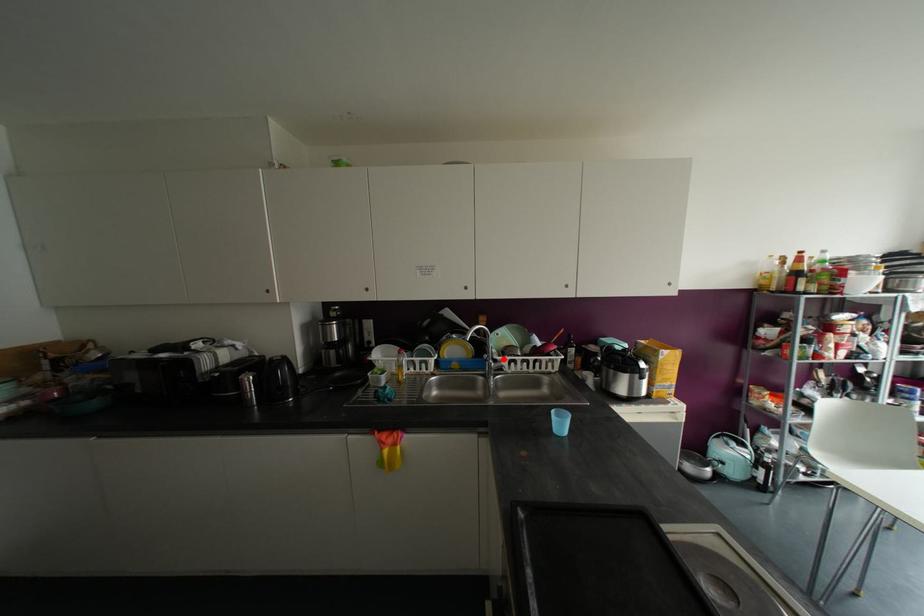
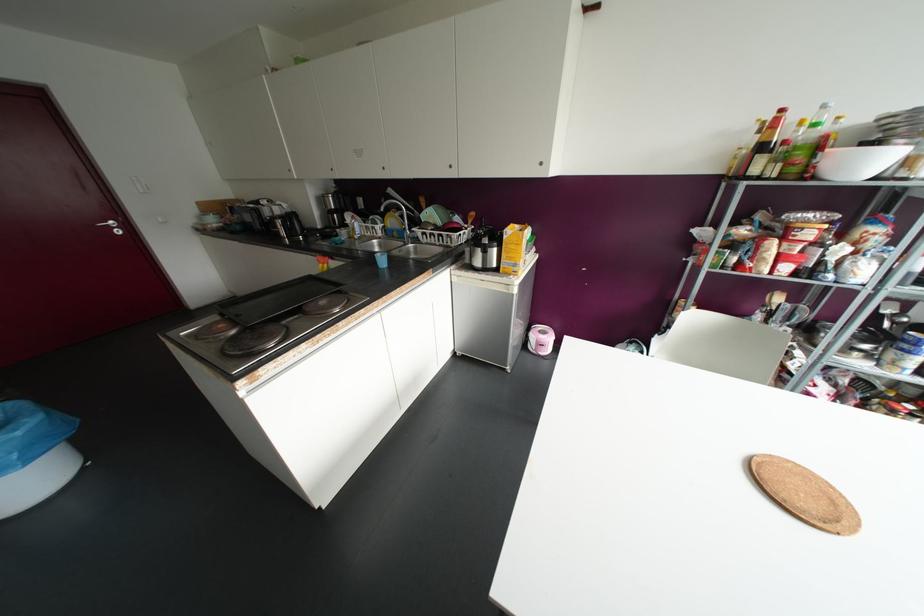
Where in the second image is the point corresponding to the highlighted location from the first image?

(417, 231)